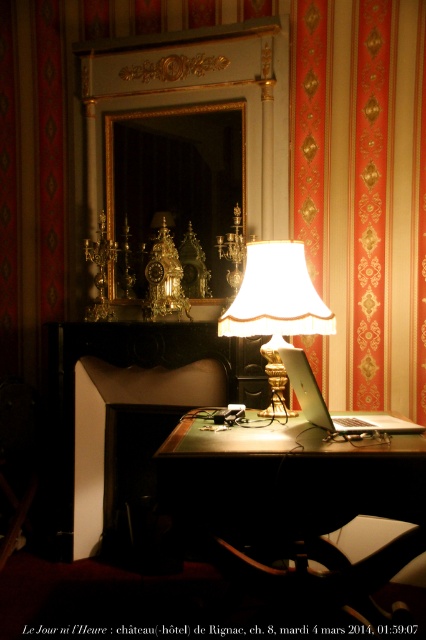
The width and height of the screenshot is (426, 640). What do you see at coordinates (293, 500) in the screenshot?
I see `metallic silver table at center` at bounding box center [293, 500].

Between metallic silver table at center and satin silver laptop at center, which one has more height?

Standing taller between the two is metallic silver table at center.

You are a GUI agent. You are given a task and a screenshot of the screen. Output one action in this format:
    pyautogui.click(x=<x>, y=<y>)
    Task: Click on the metallic silver table at center
    
    Given the screenshot: What is the action you would take?
    pyautogui.click(x=293, y=500)

In order to click on metallic silver table at center in this screenshot , I will do point(293,500).

Between point (402, 440) and point (267, 296), which one is positioned behind?

The point (267, 296) is behind.

The height and width of the screenshot is (640, 426). Identify the location of metallic silver table at center. (293, 500).

Where is `metallic silver table at center`? This screenshot has width=426, height=640. metallic silver table at center is located at coordinates (293, 500).

Which of these two, white fabric lampshade at center or satin silver laptop at center, stands taller?

Standing taller between the two is white fabric lampshade at center.

Looking at this image, does white fabric lampshade at center appear under satin silver laptop at center?

Incorrect, white fabric lampshade at center is not positioned below satin silver laptop at center.

The height and width of the screenshot is (640, 426). Identify the location of white fabric lampshade at center. (276, 308).

Find the location of a particular element. white fabric lampshade at center is located at coordinates pyautogui.click(x=276, y=308).